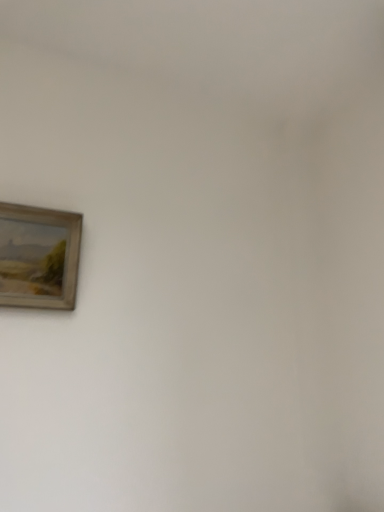
The width and height of the screenshot is (384, 512). In order to click on wooden picture frame at upper left in this screenshot , I will do `click(38, 257)`.

What do you see at coordinates (38, 257) in the screenshot? I see `wooden picture frame at upper left` at bounding box center [38, 257].

The height and width of the screenshot is (512, 384). I want to click on wooden picture frame at upper left, so click(x=38, y=257).